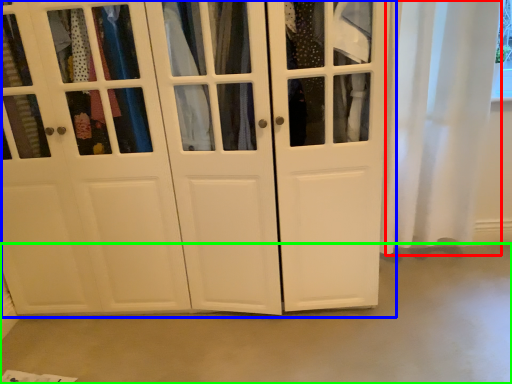
Question: Estimate the real-world distances between objects in this image. Which object is farther from curtain (highlighted by a red box), cupboard (highlighted by a blue box) or concrete (highlighted by a green box)?

Choices:
 (A) cupboard
 (B) concrete

Answer: (B)